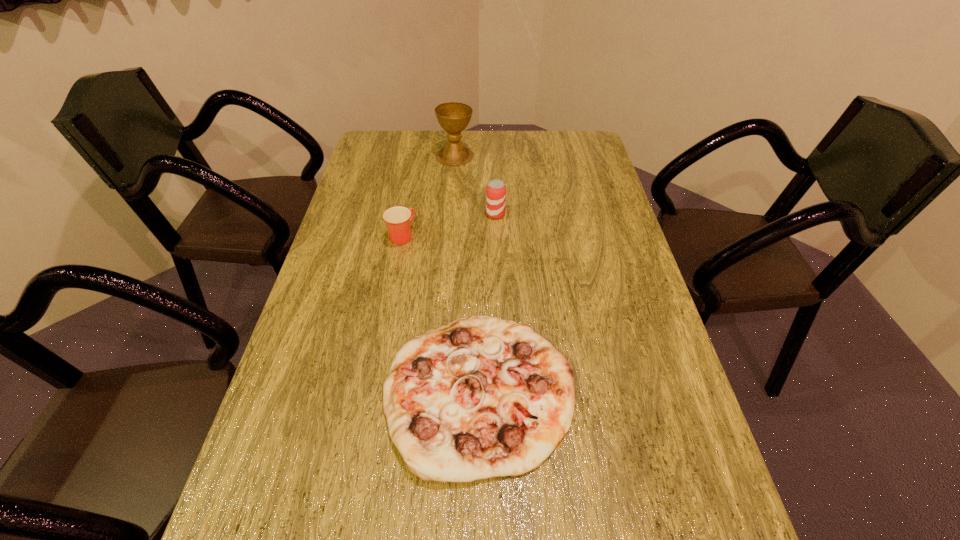
What are the coordinates of `free spot located 0.160m on the back of the cup` in the screenshot? It's located at (409, 194).

Where is `vacant space located 0.140m on the back of the nearest object`? The height and width of the screenshot is (540, 960). vacant space located 0.140m on the back of the nearest object is located at coordinates (479, 278).

You are a GUI agent. You are given a task and a screenshot of the screen. Output one action in this format:
    pyautogui.click(x=<x>, y=<y>)
    Task: Click on the object that is at the far edge
    
    Given the screenshot: What is the action you would take?
    pyautogui.click(x=453, y=117)

The image size is (960, 540). In order to click on object that is at the left edge in this screenshot , I will do `click(398, 219)`.

This screenshot has width=960, height=540. Find the location of `vacant space at the far edge`. vacant space at the far edge is located at coordinates (483, 156).

Find the location of a particular element. The image size is (960, 540). vacant space at the left edge of the desktop is located at coordinates (324, 348).

The height and width of the screenshot is (540, 960). What are the coordinates of `vacant space at the right edge of the desktop` in the screenshot? It's located at (636, 286).

I want to click on free space at the far left corner, so click(370, 140).

The height and width of the screenshot is (540, 960). Find the location of `vacant space at the far right corner of the desktop`. vacant space at the far right corner of the desktop is located at coordinates (553, 143).

Where is `vacant area that lies between the shortest object and the chalice`? The width and height of the screenshot is (960, 540). vacant area that lies between the shortest object and the chalice is located at coordinates (467, 273).